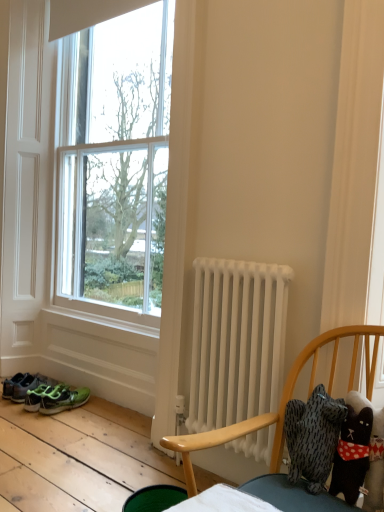
Question: In terms of height, does green matte sneakers at lower left, arranged as the second footwear when viewed from the left, look taller or shorter compared to white fabric curtain at right?

Choices:
 (A) tall
 (B) short

Answer: (B)

Question: Considering the positions of green matte sneakers at lower left, arranged as the second footwear when viewed from the left, and white fabric curtain at right in the image, is green matte sneakers at lower left, arranged as the second footwear when viewed from the left, wider or thinner than white fabric curtain at right?

Choices:
 (A) wide
 (B) thin

Answer: (A)

Question: Which of these objects is positioned closest to the white matte radiator at center?

Choices:
 (A) green mesh sneakers at lower left, acting as the 1th footwear starting from the left
 (B) green matte sneakers at lower left, the first footwear viewed from the right
 (C) white fabric curtain at right
 (D) soft plush cat at right

Answer: (D)

Question: Which object is positioned closest to the soft plush cat at right?

Choices:
 (A) white fabric curtain at right
 (B) green mesh sneakers at lower left, acting as the 1th footwear starting from the left
 (C) green matte sneakers at lower left, the first footwear viewed from the right
 (D) white matte radiator at center

Answer: (D)